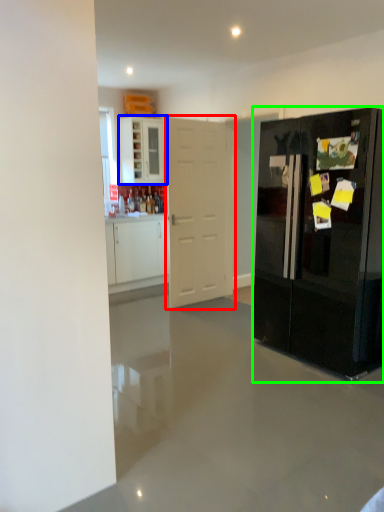
Question: Based on their relative distances, which object is farther from door (highlighted by a red box)? Choose from cabinetry (highlighted by a blue box) and refrigerator (highlighted by a green box).

Choices:
 (A) cabinetry
 (B) refrigerator

Answer: (A)